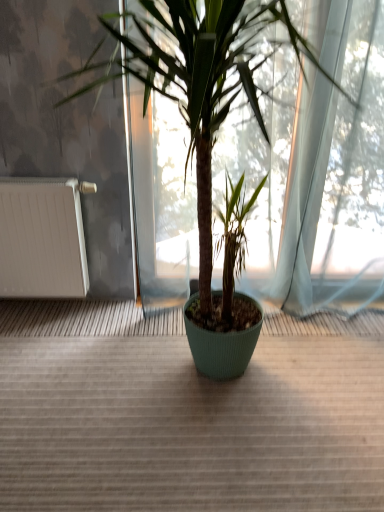
You are a GUI agent. You are given a task and a screenshot of the screen. Output one action in this format:
    pyautogui.click(x=<x>, y=<y>)
    Task: Click on the free location to the left of green ribbed pot at center
    The image size is (384, 512).
    Given the screenshot: What is the action you would take?
    pyautogui.click(x=49, y=368)